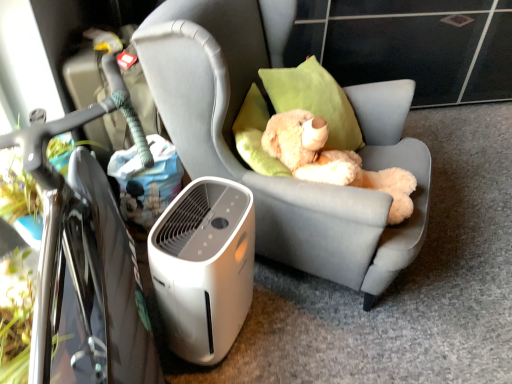
Question: Considering the positions of black glossy bicycle at left and white plastic air purifier at lower left in the image, is black glossy bicycle at left bigger or smaller than white plastic air purifier at lower left?

Choices:
 (A) small
 (B) big

Answer: (B)

Question: Would you say black glossy bicycle at left is inside or outside white plastic air purifier at lower left?

Choices:
 (A) outside
 (B) inside

Answer: (A)

Question: Considering the real-world distances, which object is farthest from the white plastic air purifier at lower left?

Choices:
 (A) black glossy bicycle at left
 (B) light gray fabric chair at center
 (C) fluffy beige teddy bear at center

Answer: (C)

Question: Which object is positioned farthest from the black glossy bicycle at left?

Choices:
 (A) white plastic air purifier at lower left
 (B) fluffy beige teddy bear at center
 (C) light gray fabric chair at center

Answer: (B)